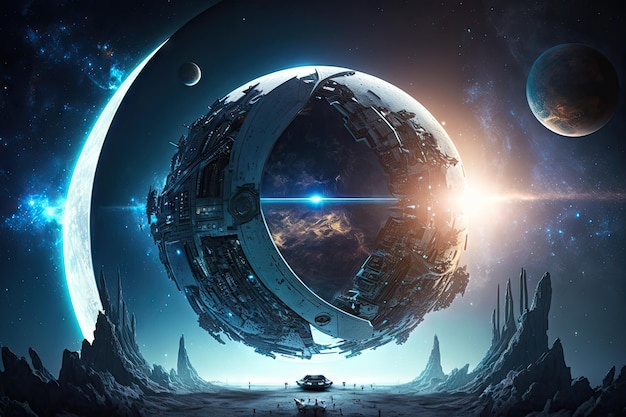
Locate an element on the screen. bright yellow light is located at coordinates (476, 202).